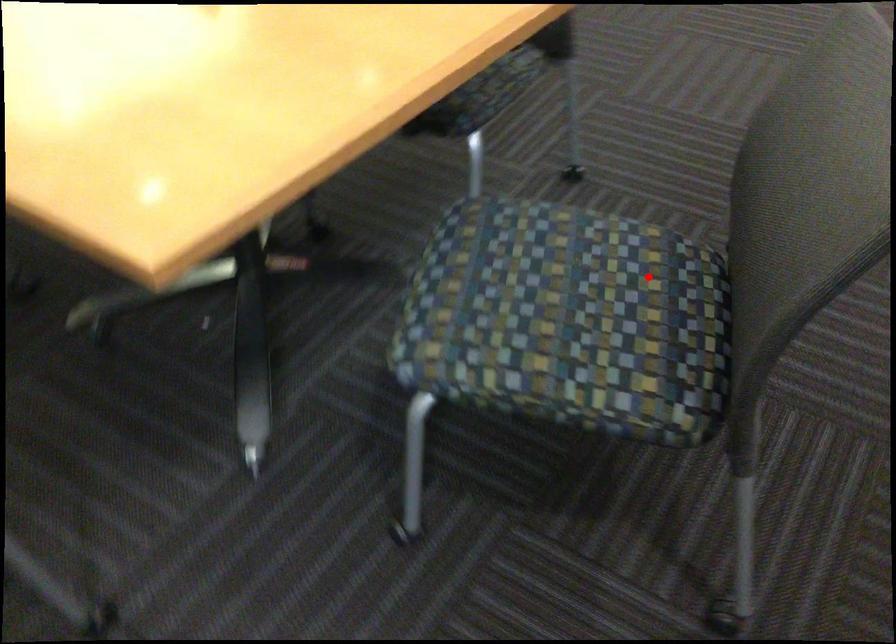
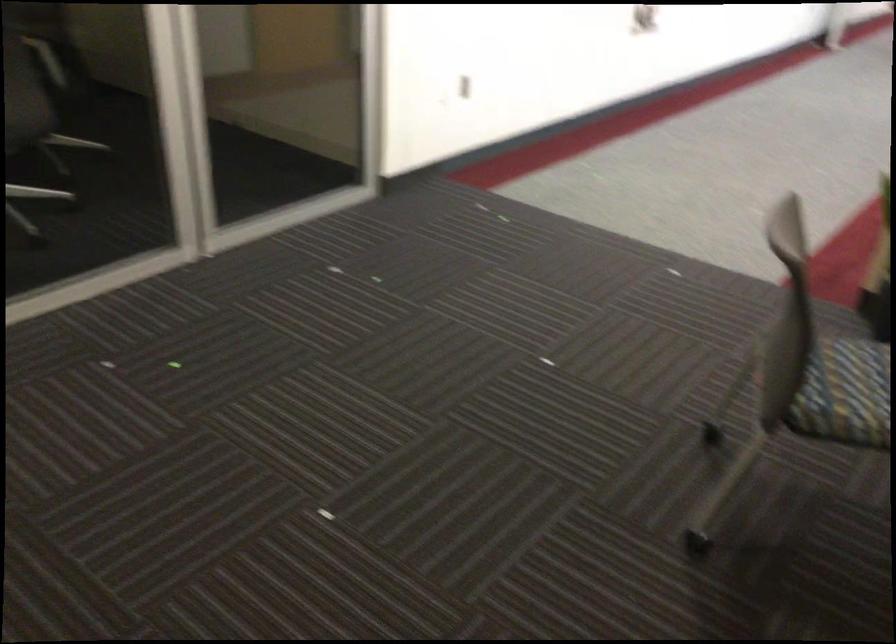
Where in the second image is the point corresponding to the highlighted location from the first image?

(845, 393)